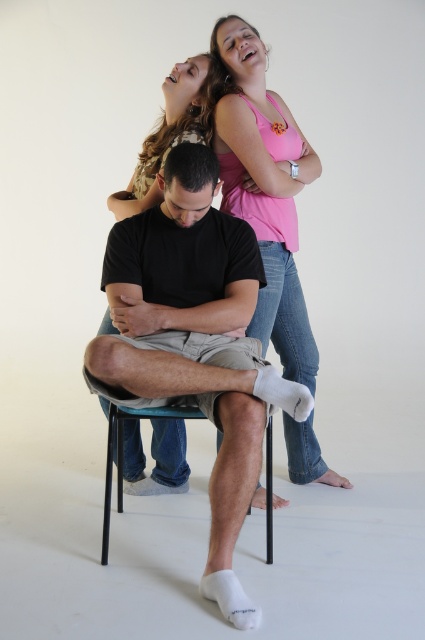
You are a fashion designer analyzing the image of a person wearing a black cotton shirt at center and a black matte arm at center. Which item appears bigger in the image?

The black cotton shirt at center has a larger size compared to the black matte arm at center, so the black cotton shirt at center appears bigger in the image.